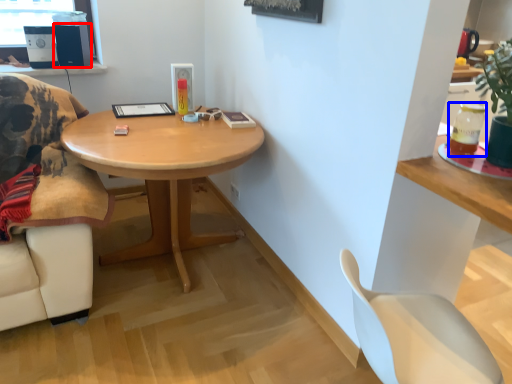
Question: Among these objects, which one is farthest to the camera, speaker (highlighted by a red box) or beverage (highlighted by a blue box)?

Choices:
 (A) speaker
 (B) beverage

Answer: (A)